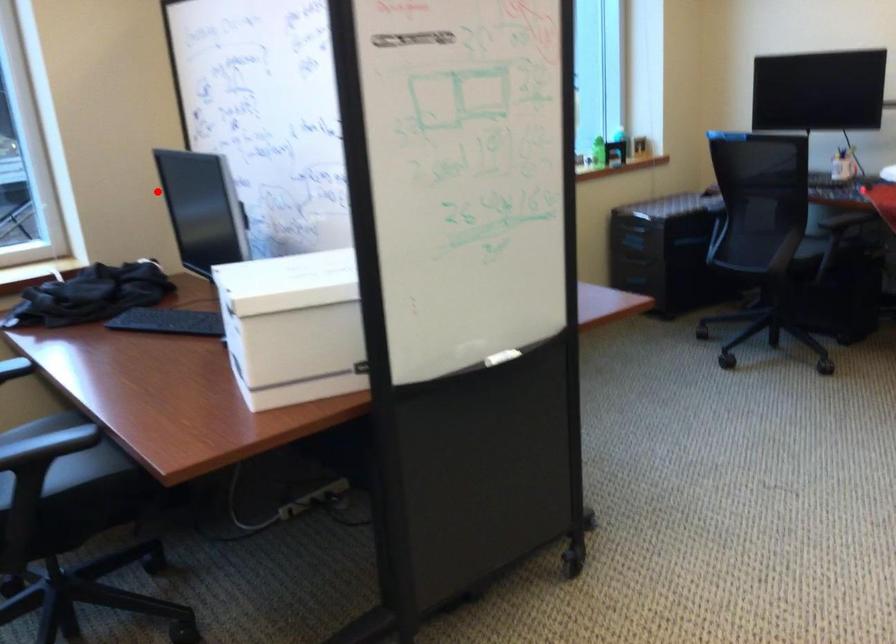
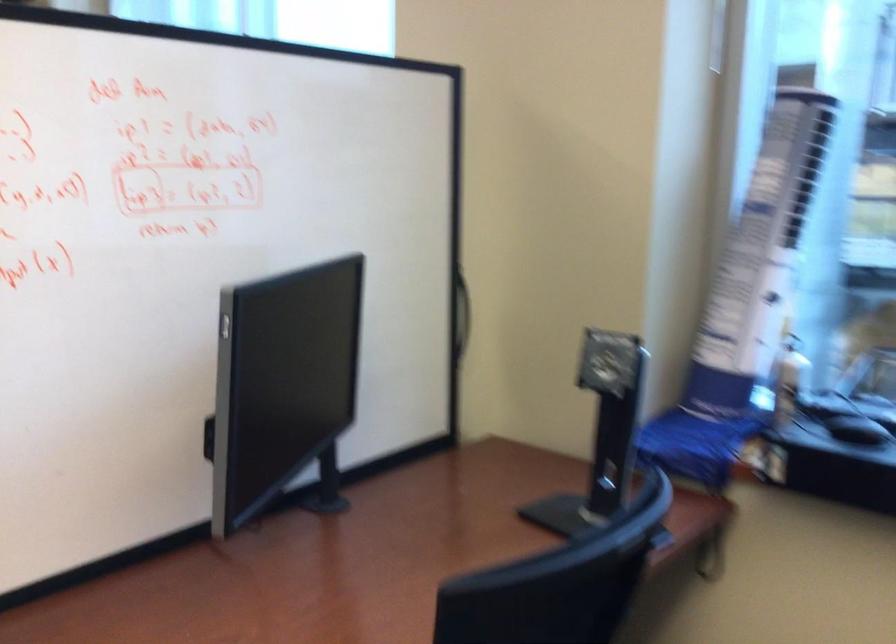
Question: I am providing you with two images of the same scene from different viewpoints. A red point is shown in image1. For the corresponding object point in image2, is it positioned nearer or farther from the camera?

Choices:
 (A) Nearer
 (B) Farther

Answer: (A)